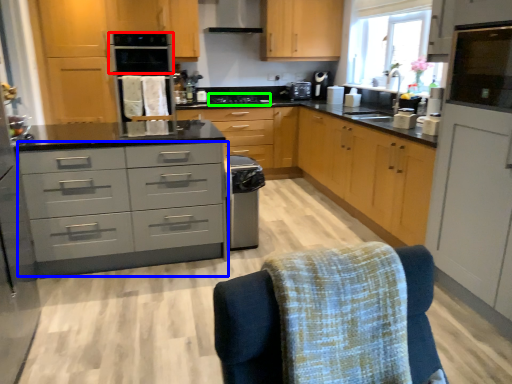
Question: Estimate the real-world distances between objects in this image. Which object is farther from kitchen appliance (highlighted by a red box), chest of drawers (highlighted by a blue box) or stove (highlighted by a green box)?

Choices:
 (A) chest of drawers
 (B) stove

Answer: (A)